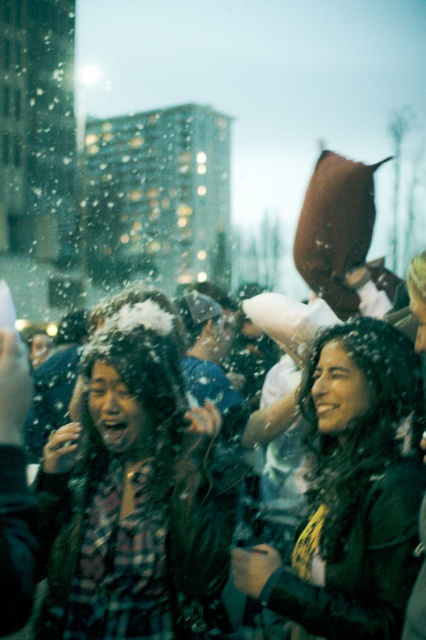
From the picture: Who is more distant from viewer, [187,636] or [331,628]?

The point [187,636] is more distant.

In the scene shown: Who is positioned more to the right, plaid fabric scarf at center or shiny black jacket at center?

From the viewer's perspective, shiny black jacket at center appears more on the right side.

The image size is (426, 640). I want to click on plaid fabric scarf at center, so click(x=135, y=497).

Identify the location of plaid fabric scarf at center. (135, 497).